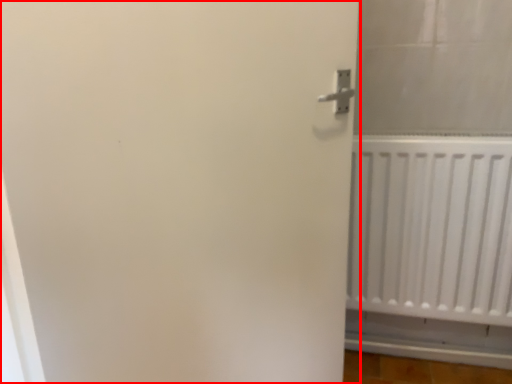
Question: From the image's perspective, considering the relative positions of door (annotated by the red box) and radiator in the image provided, where is door (annotated by the red box) located with respect to the staircase?

Choices:
 (A) above
 (B) below

Answer: (B)